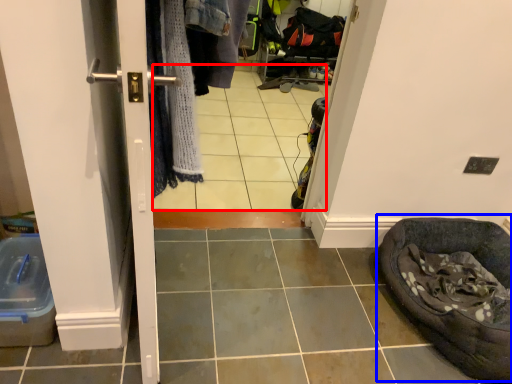
Question: Among these objects, which one is farthest to the camera, tile (highlighted by a red box) or bean bag chair (highlighted by a blue box)?

Choices:
 (A) tile
 (B) bean bag chair

Answer: (B)